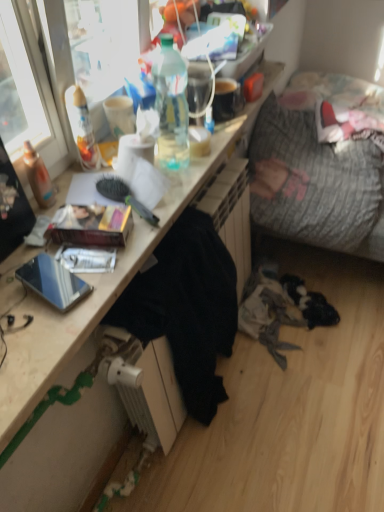
Question: In which direction should I rotate to look at translucent plastic bottle at upper center, acting as the 1th bottle starting from the right?

Choices:
 (A) right
 (B) left

Answer: (B)

Question: Can you confirm if textured gray fabric couch at right is thinner than translucent plastic bottle at upper center, marked as the second bottle in a left-to-right arrangement?

Choices:
 (A) no
 (B) yes

Answer: (A)

Question: Is textured gray fabric couch at right oriented away from translucent plastic bottle at upper center, marked as the second bottle in a left-to-right arrangement?

Choices:
 (A) no
 (B) yes

Answer: (A)

Question: Is textured gray fabric couch at right far away from translucent plastic bottle at upper center, marked as the second bottle in a left-to-right arrangement?

Choices:
 (A) no
 (B) yes

Answer: (A)

Question: Are textured gray fabric couch at right and translucent plastic bottle at upper center, marked as the second bottle in a left-to-right arrangement, beside each other?

Choices:
 (A) no
 (B) yes

Answer: (A)

Question: From the image's perspective, would you say textured gray fabric couch at right is shown under translucent plastic bottle at upper center, acting as the 1th bottle starting from the right?

Choices:
 (A) no
 (B) yes

Answer: (A)

Question: From a real-world perspective, is textured gray fabric couch at right under translucent plastic bottle at upper center, acting as the 1th bottle starting from the right?

Choices:
 (A) yes
 (B) no

Answer: (A)

Question: Can you confirm if matte cardboard book at center is wider than textured gray fabric couch at right?

Choices:
 (A) yes
 (B) no

Answer: (B)

Question: Is matte cardboard book at center at the left side of textured gray fabric couch at right?

Choices:
 (A) no
 (B) yes

Answer: (B)

Question: Can you confirm if matte cardboard book at center is bigger than textured gray fabric couch at right?

Choices:
 (A) no
 (B) yes

Answer: (A)

Question: From a real-world perspective, is matte cardboard book at center positioned over textured gray fabric couch at right based on gravity?

Choices:
 (A) no
 (B) yes

Answer: (B)

Question: From the image's perspective, does matte cardboard book at center appear higher than textured gray fabric couch at right?

Choices:
 (A) yes
 (B) no

Answer: (B)

Question: From the image's perspective, is matte cardboard book at center located beneath textured gray fabric couch at right?

Choices:
 (A) yes
 (B) no

Answer: (A)

Question: From a real-world perspective, is wooden desk at center on black fabric at lower center?

Choices:
 (A) yes
 (B) no

Answer: (A)